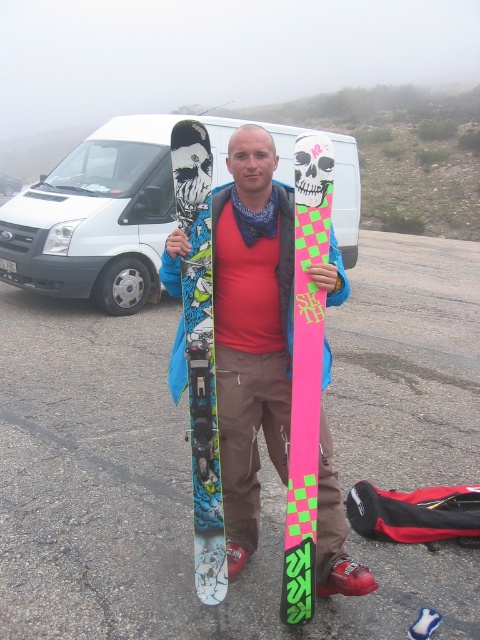
Does matte plastic skis at center come behind white matte van at upper left?

No, it is in front of white matte van at upper left.

Can you confirm if matte plastic skis at center is positioned to the left of white matte van at upper left?

Incorrect, matte plastic skis at center is not on the left side of white matte van at upper left.

Is point (250, 492) in front of point (14, 188)?

Yes, point (250, 492) is closer to viewer.

At what (x,y) coordinates should I click in order to perform the action: click on matte plastic skis at center. Please return your answer as a coordinate pair (x, y). This screenshot has height=640, width=480. Looking at the image, I should click on (252, 326).

Who is taller, matte plastic skis at center or white matte van at upper center?

Standing taller between the two is white matte van at upper center.

Does matte plastic skis at center lie in front of white matte van at upper center?

That is False.

The width and height of the screenshot is (480, 640). Find the location of `matte plastic skis at center`. matte plastic skis at center is located at coordinates (252, 326).

This screenshot has height=640, width=480. I want to click on matte plastic skis at center, so click(252, 326).

Is matte plastic skis at center closer to the viewer compared to matte blue snowboard at center?

That is False.

Based on the photo, is matte plastic skis at center shorter than matte blue snowboard at center?

In fact, matte plastic skis at center may be taller than matte blue snowboard at center.

Between point (250, 481) and point (192, 232), which one is positioned behind?

Point (250, 481)

At what (x,y) coordinates should I click in order to perform the action: click on matte plastic skis at center. Please return your answer as a coordinate pair (x, y). Looking at the image, I should click on (252, 326).